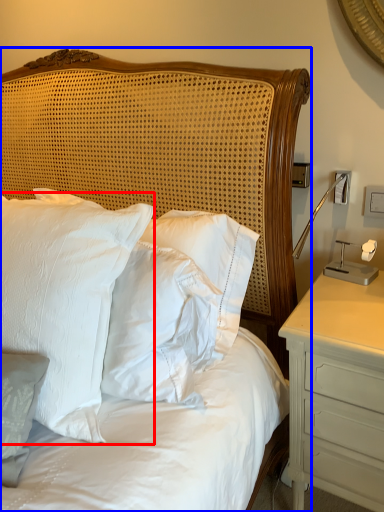
Question: Among these objects, which one is nearest to the camera, pillow (highlighted by a red box) or bed (highlighted by a blue box)?

Choices:
 (A) pillow
 (B) bed

Answer: (A)